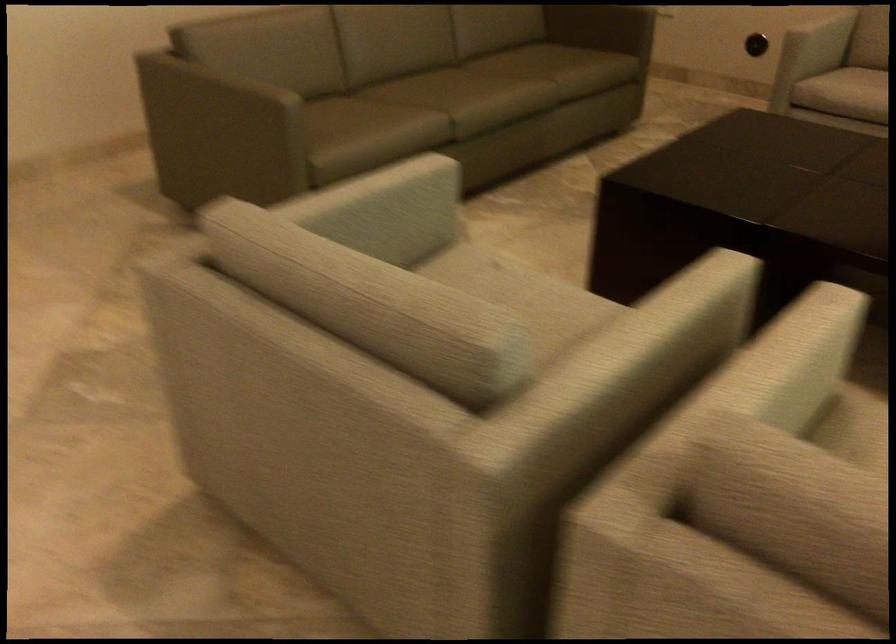
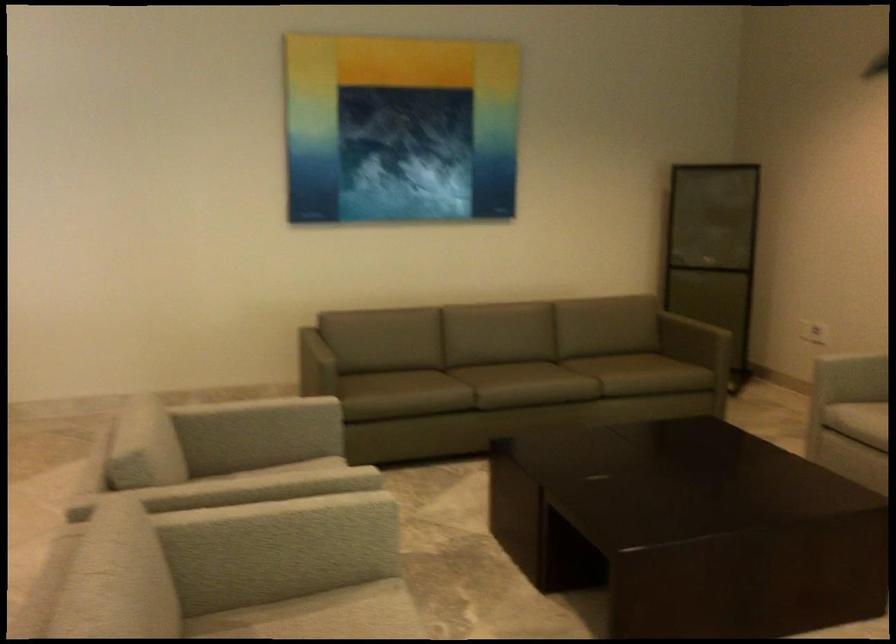
Locate, in the second image, the point that corresponds to [672,308] in the first image.

(254, 484)